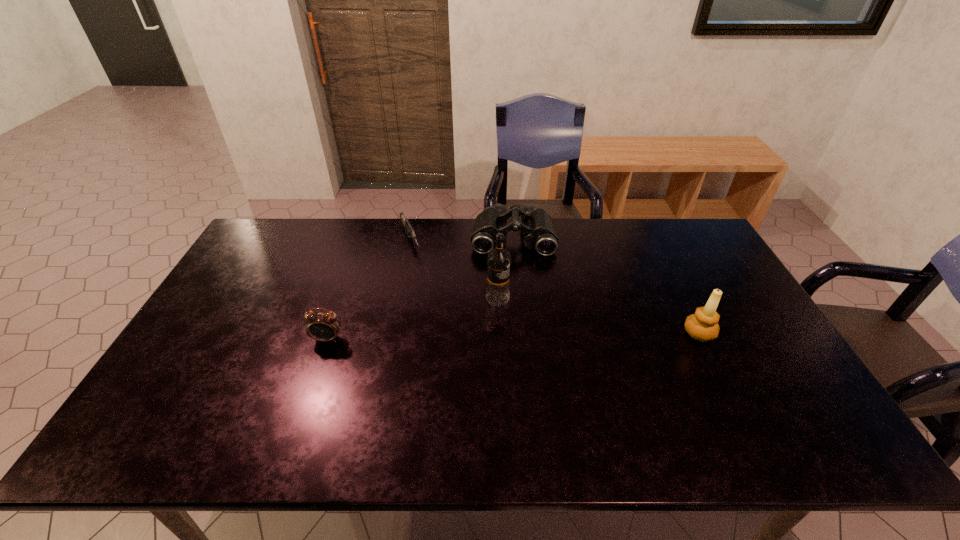
The image size is (960, 540). Find the location of `vacant space located on the label of the vodka`. vacant space located on the label of the vodka is located at coordinates (583, 349).

Where is `blank space located on the label of the vodka`? blank space located on the label of the vodka is located at coordinates (549, 329).

Image resolution: width=960 pixels, height=540 pixels. Identify the location of free space located on the label of the vodka. (520, 313).

The width and height of the screenshot is (960, 540). I want to click on blank space located on the front-facing side of the binoculars, so click(x=514, y=338).

Find the location of a particular element. The image size is (960, 540). free region located 0.340m on the front-facing side of the binoculars is located at coordinates (514, 332).

Where is `free space located on the front-facing side of the binoculars`? free space located on the front-facing side of the binoculars is located at coordinates (514, 314).

This screenshot has height=540, width=960. What are the coordinates of `vacant area situated 0.220m aimed along the barrel of the fourth object from right to left` in the screenshot? It's located at (434, 295).

The image size is (960, 540). I want to click on free space located 0.370m aimed along the barrel of the fourth object from right to left, so (452, 328).

At what (x,y) coordinates should I click in order to perform the action: click on blank area located 0.100m aimed along the barrel of the fourth object from right to left. Please return your answer as a coordinate pair (x, y). This screenshot has width=960, height=540. Looking at the image, I should click on (422, 272).

You are a GUI agent. You are given a task and a screenshot of the screen. Output one action in this format:
    pyautogui.click(x=<x>, y=<y>)
    Task: Click on the binoculars present at the far edge
    The width and height of the screenshot is (960, 540).
    Given the screenshot: What is the action you would take?
    pyautogui.click(x=537, y=225)